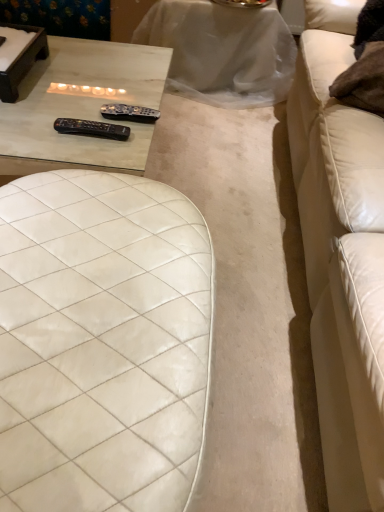
Question: From the image's perspective, is white leather couch at right positioned above or below matte glass table at upper left, which ranks as the first table in bottom-to-top order?

Choices:
 (A) below
 (B) above

Answer: (A)

Question: From a real-world perspective, is white leather couch at right positioned above or below matte glass table at upper left, which is counted as the second table, starting from the top?

Choices:
 (A) below
 (B) above

Answer: (B)

Question: Which object is positioned closest to the white marble table at upper center, placed as the 1th table when sorted from top to bottom?

Choices:
 (A) matte glass table at upper left, the second table viewed from the back
 (B) white quilted leather ottoman at center
 (C) black plastic remote at center, positioned as the 1th remote in front-to-back order
 (D) white leather couch at right
 (E) black plastic remote at upper center, marked as the first remote in a back-to-front arrangement

Answer: (D)

Question: Considering the real-world distances, which object is farthest from the black plastic remote at upper center, acting as the 2th remote starting from the front?

Choices:
 (A) white leather couch at right
 (B) black plastic remote at center, positioned as the 1th remote in front-to-back order
 (C) matte glass table at upper left, which ranks as the first table in bottom-to-top order
 (D) white quilted leather ottoman at center
 (E) white marble table at upper center, positioned as the second table in bottom-to-top order

Answer: (E)